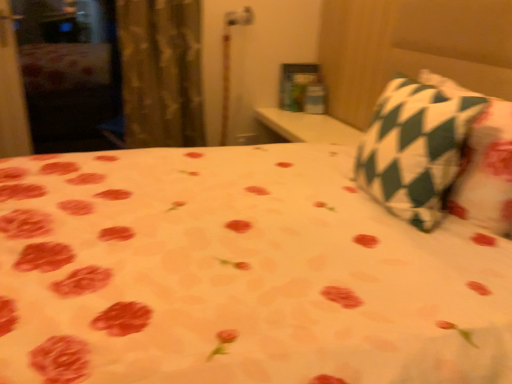
Question: Is textured beige curtain at left inside or outside of green checkered pillow at upper right?

Choices:
 (A) outside
 (B) inside

Answer: (A)

Question: From a real-world perspective, is textured beige curtain at left physically located above or below green checkered pillow at upper right?

Choices:
 (A) above
 (B) below

Answer: (B)

Question: Is textured beige curtain at left wider or thinner than green checkered pillow at upper right?

Choices:
 (A) thin
 (B) wide

Answer: (B)

Question: From the image's perspective, is green checkered pillow at upper right positioned above or below textured beige curtain at left?

Choices:
 (A) below
 (B) above

Answer: (A)

Question: In terms of width, does green checkered pillow at upper right look wider or thinner when compared to textured beige curtain at left?

Choices:
 (A) thin
 (B) wide

Answer: (A)

Question: Looking at the image, does green checkered pillow at upper right seem bigger or smaller compared to textured beige curtain at left?

Choices:
 (A) big
 (B) small

Answer: (B)

Question: Which is correct: green checkered pillow at upper right is inside textured beige curtain at left, or outside of it?

Choices:
 (A) outside
 (B) inside

Answer: (A)